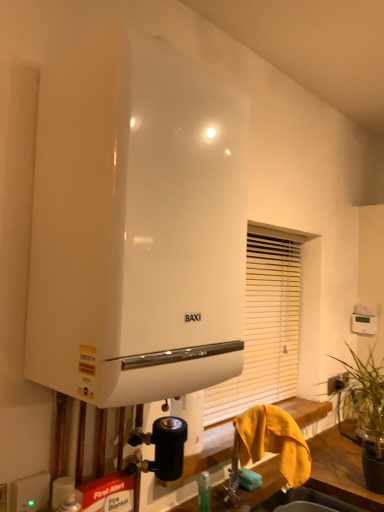
Find the location of a particular element. The image size is (384, 512). yellow fabric towel at lower right is located at coordinates (274, 441).

Image resolution: width=384 pixels, height=512 pixels. What are the coordinates of `green leafy plant at right` in the screenshot? It's located at (363, 402).

Measure the distance between point (345, 407) and camera.

They are 6.11 feet apart.

Image resolution: width=384 pixels, height=512 pixels. Find the location of `white glossy sink at lower center`. white glossy sink at lower center is located at coordinates (304, 500).

Locate an element on the screen. The image size is (384, 512). white matte soap at lower center is located at coordinates (249, 479).

What do you see at coordinates (136, 225) in the screenshot?
I see `white glossy water heater at center` at bounding box center [136, 225].

Find the location of a particular element. The height and width of the screenshot is (512, 384). yellow fabric towel at lower right is located at coordinates (274, 441).

Is yellow fabric towel at lower right further to the viewer compared to white matte soap at lower center?

No, it is in front of white matte soap at lower center.

Measure the distance between yellow fabric towel at lower right and white matte soap at lower center.

yellow fabric towel at lower right is 6.14 inches away from white matte soap at lower center.

From the picture: Does yellow fabric towel at lower right contain white matte soap at lower center?

No, white matte soap at lower center is not a part of yellow fabric towel at lower right.

Considering the relative sizes of yellow fabric towel at lower right and white matte soap at lower center in the image provided, is yellow fabric towel at lower right smaller than white matte soap at lower center?

Actually, yellow fabric towel at lower right might be larger than white matte soap at lower center.

Considering the sizes of white glossy sink at lower center and yellow fabric towel at lower right in the image, is white glossy sink at lower center wider or thinner than yellow fabric towel at lower right?

Clearly, white glossy sink at lower center has more width compared to yellow fabric towel at lower right.

Does white glossy sink at lower center appear on the right side of yellow fabric towel at lower right?

Indeed, white glossy sink at lower center is positioned on the right side of yellow fabric towel at lower right.

From the image's perspective, is white glossy sink at lower center located above yellow fabric towel at lower right?

No, from the image's perspective, white glossy sink at lower center is not over yellow fabric towel at lower right.

Consider the image. Does white glossy sink at lower center have a larger size compared to yellow fabric towel at lower right?

No, white glossy sink at lower center is not bigger than yellow fabric towel at lower right.

Does point (336, 503) lie behind point (16, 485)?

Yes, it is.

Locate an element on the screen. This screenshot has width=384, height=512. sink behind the white plastic electric outlet at lower left is located at coordinates (304, 500).

Is white glossy sink at lower center far from white plastic electric outlet at lower left?

Yes, white glossy sink at lower center and white plastic electric outlet at lower left are located far from each other.

Which of these two, white glossy sink at lower center or white plastic electric outlet at lower left, is smaller?

Smaller between the two is white plastic electric outlet at lower left.

You are a GUI agent. You are given a task and a screenshot of the screen. Output one action in this format:
    pyautogui.click(x=<x>, y=<y>)
    Task: Click on the shutter behind the green leafy plant at right
    This screenshot has width=384, height=512.
    Given the screenshot: What is the action you would take?
    pyautogui.click(x=265, y=326)

Choose the correct answer: Is white matte shutter at center inside green leafy plant at right or outside it?

white matte shutter at center is located beyond the bounds of green leafy plant at right.

From the image's perspective, is white matte shutter at center positioned above or below green leafy plant at right?

Based on their image positions, white matte shutter at center is located above green leafy plant at right.

Is point (259, 239) positioned before point (348, 405)?

No, (259, 239) is further to viewer.

Would you consider white matte soap at lower center to be distant from yellow fabric towel at lower right?

They are positioned close to each other.

Does white matte soap at lower center have a larger size compared to yellow fabric towel at lower right?

Actually, white matte soap at lower center might be smaller than yellow fabric towel at lower right.

Is white matte soap at lower center oriented towards yellow fabric towel at lower right?

No, white matte soap at lower center does not turn towards yellow fabric towel at lower right.

Considering the positions of objects white matte soap at lower center and yellow fabric towel at lower right in the image provided, who is more to the left, white matte soap at lower center or yellow fabric towel at lower right?

From the viewer's perspective, white matte soap at lower center appears more on the left side.

Between white matte soap at lower center and green leafy plant at right, which one has larger size?

green leafy plant at right is bigger.

In the image, there is a white matte soap at lower center. What are the coordinates of `plant above it (from the image's perspective)` in the screenshot? It's located at (363, 402).

From the image's perspective, which object appears higher, white matte soap at lower center or green leafy plant at right?

green leafy plant at right, from the image's perspective.

Is white matte soap at lower center oriented towards green leafy plant at right?

No, white matte soap at lower center does not turn towards green leafy plant at right.

In terms of size, does white matte soap at lower center appear bigger or smaller than white plastic electric outlet at lower left?

white matte soap at lower center is smaller than white plastic electric outlet at lower left.

From a real-world perspective, is white matte soap at lower center under white plastic electric outlet at lower left?

Yes, from a real-world perspective, white matte soap at lower center is under white plastic electric outlet at lower left.

Is white plastic electric outlet at lower left at the back of white matte soap at lower center?

No, white matte soap at lower center's orientation is not away from white plastic electric outlet at lower left.

Considering the positions of objects white matte soap at lower center and white plastic electric outlet at lower left in the image provided, who is more to the left, white matte soap at lower center or white plastic electric outlet at lower left?

white plastic electric outlet at lower left is more to the left.

You are a GUI agent. You are given a task and a screenshot of the screen. Output one action in this format:
    pyautogui.click(x=<x>, y=<y>)
    Task: Click on the bath towel above the white matte soap at lower center (from a real-world perspective)
    
    Given the screenshot: What is the action you would take?
    [x=274, y=441]

Identify the location of bath towel on the left side of white glossy sink at lower center. (274, 441).

Considering their positions, is green leafy plant at right positioned further to white plastic electric outlet at lower left than white glossy water heater at center?

Among the two, green leafy plant at right is located further to white plastic electric outlet at lower left.

When comparing their distances from white plastic electric outlet at lower left, does green leafy plant at right or white matte soap at lower center seem further?

green leafy plant at right is further to white plastic electric outlet at lower left.

When comparing their distances from white plastic electric outlet at lower left, does green leafy plant at right or yellow fabric towel at lower right seem further?

green leafy plant at right.

Estimate the real-world distances between objects in this image. Which object is further from green leafy plant at right, white plastic electric outlet at lower left or white matte soap at lower center?

white plastic electric outlet at lower left lies further to green leafy plant at right than the other object.

Looking at the image, which one is located closer to white glossy water heater at center, white matte shutter at center or yellow fabric towel at lower right?

Based on the image, yellow fabric towel at lower right appears to be nearer to white glossy water heater at center.

Which object lies nearer to the anchor point white matte soap at lower center, green leafy plant at right or white plastic electric outlet at lower left?

The object closer to white matte soap at lower center is green leafy plant at right.

In the scene shown: Which object lies nearer to the anchor point white matte shutter at center, white plastic electric outlet at lower left or white glossy sink at lower center?

white glossy sink at lower center.

Looking at the image, which one is located closer to yellow fabric towel at lower right, white matte soap at lower center or white matte shutter at center?

white matte soap at lower center is closer to yellow fabric towel at lower right.

The image size is (384, 512). I want to click on electric outlet between white glossy water heater at center and yellow fabric towel at lower right vertically, so click(30, 493).

Where is `soap between white plastic electric outlet at lower left and white glossy sink at lower center`? This screenshot has width=384, height=512. soap between white plastic electric outlet at lower left and white glossy sink at lower center is located at coordinates (249, 479).

The image size is (384, 512). Find the location of `bath towel between white matte shutter at center and white matte soap at lower center from top to bottom`. bath towel between white matte shutter at center and white matte soap at lower center from top to bottom is located at coordinates (274, 441).

Identify the location of bath towel between white matte soap at lower center and green leafy plant at right from left to right. This screenshot has height=512, width=384. (274, 441).